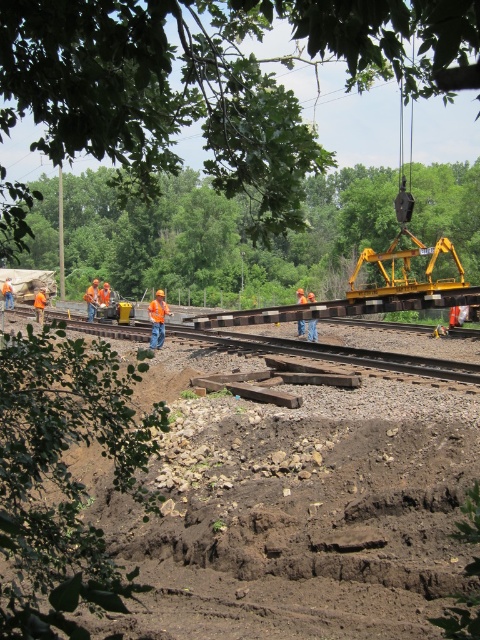
Question: Can you confirm if orange hard hat at left is positioned to the left of orange reflective vest at left?

Choices:
 (A) no
 (B) yes

Answer: (A)

Question: Which is nearer to the brown dirt at center?

Choices:
 (A) yellow metallic crane at right
 (B) orange reflective vest at left
 (C) orange hard hat at left
 (D) brown wooden track at center

Answer: (D)

Question: In this image, where is brown wooden track at center located relative to orange hard hat at left?

Choices:
 (A) right
 (B) left

Answer: (A)

Question: Does yellow metallic crane at right appear on the left side of orange reflective vest at left?

Choices:
 (A) yes
 (B) no

Answer: (B)

Question: Which point is closer to the camera taking this photo?

Choices:
 (A) (245, 333)
 (B) (86, 291)

Answer: (A)

Question: Based on their relative distances, which object is farther from the yellow metallic crane at right?

Choices:
 (A) brown wooden track at center
 (B) orange hard hat at left

Answer: (B)